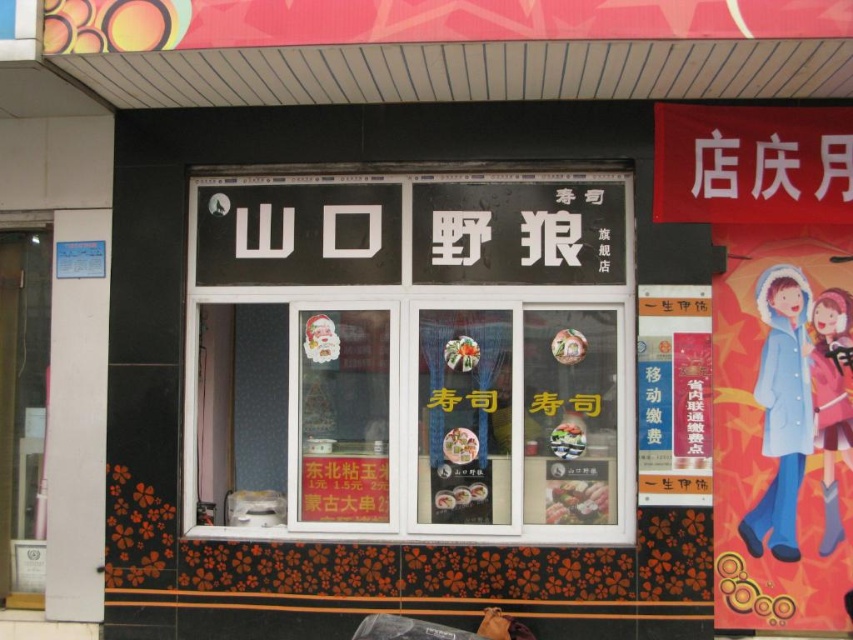
In the scene shown: Can you confirm if black glass shop window at center is bigger than pastel pink fabric at right?

Indeed, black glass shop window at center has a larger size compared to pastel pink fabric at right.

Is point (376, 330) farther from camera compared to point (820, 545)?

Yes, it is.

Between point (364, 243) and point (840, 291), which one is positioned behind?

Point (364, 243)

Locate an element on the screen. The image size is (853, 640). black glass shop window at center is located at coordinates (428, 349).

Who is shorter, blue fabric coat at right or pastel pink fabric at right?

Standing shorter between the two is pastel pink fabric at right.

I want to click on blue fabric coat at right, so click(x=781, y=410).

Where is `blue fabric coat at right`? blue fabric coat at right is located at coordinates (781, 410).

Locate an element on the screen. blue fabric coat at right is located at coordinates [781, 410].

Looking at this image, is black glass shop window at center thinner than blue fabric coat at right?

Incorrect, black glass shop window at center's width is not less than blue fabric coat at right's.

Who is more forward, (316, 272) or (805, 403)?

Point (805, 403) is in front.

Where is `black glass shop window at center`? black glass shop window at center is located at coordinates (428, 349).